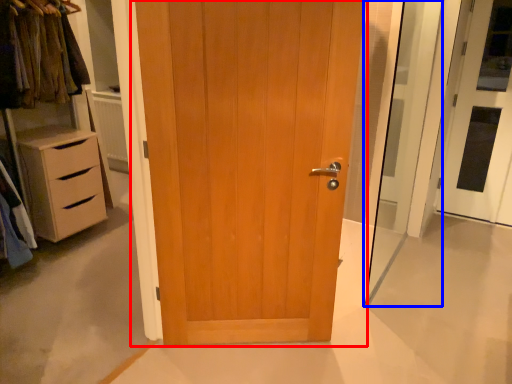
Question: Which point is further to the camera, door (highlighted by a red box) or screen door (highlighted by a blue box)?

Choices:
 (A) door
 (B) screen door

Answer: (B)